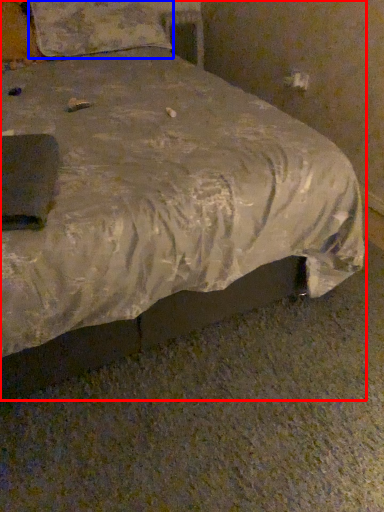
Question: Which of the following is the closest to the observer, bed (highlighted by a red box) or pillow (highlighted by a blue box)?

Choices:
 (A) bed
 (B) pillow

Answer: (A)